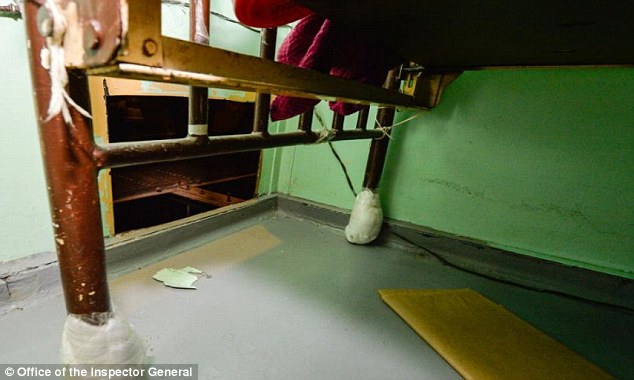
Locate an element on the screen. This screenshot has height=380, width=634. bed leg 1 is located at coordinates (82, 174).